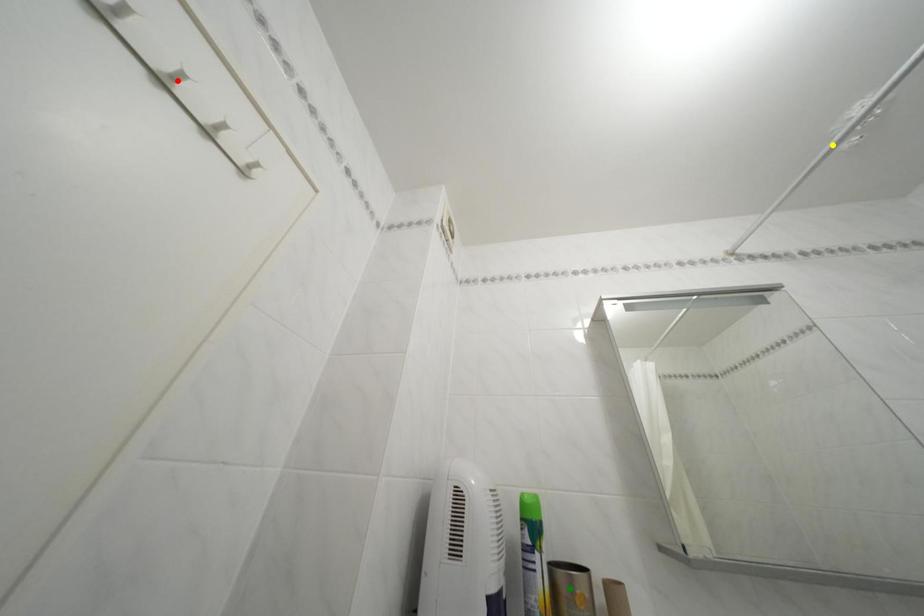
Order these from nearest to farthest:
green point, red point, yellow point

red point < green point < yellow point